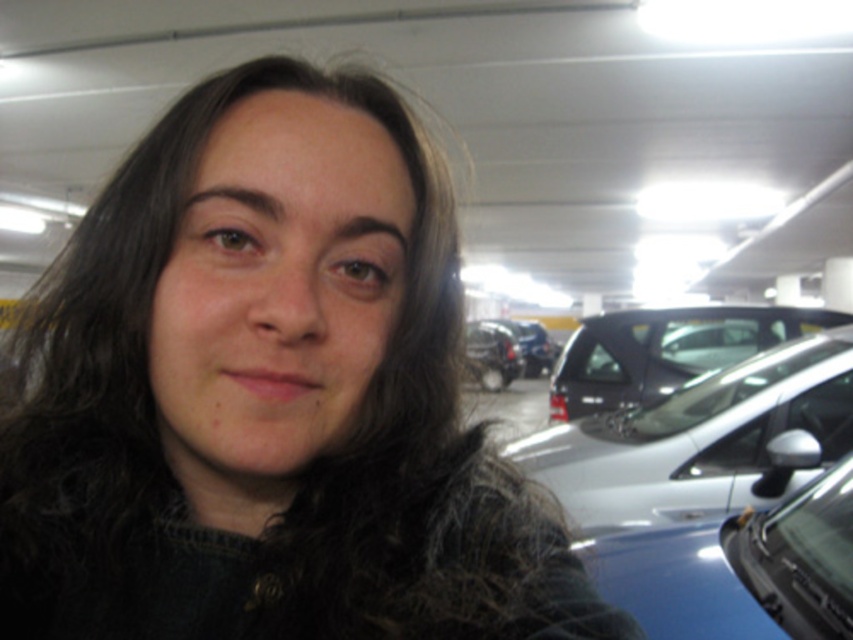
Is satin silver car at right smaller than shiny black car at center?

Incorrect, satin silver car at right is not smaller in size than shiny black car at center.

Is satin silver car at right to the left of shiny black car at center from the viewer's perspective?

Correct, you'll find satin silver car at right to the left of shiny black car at center.

Is point (733, 426) farther from camera compared to point (488, 360)?

No, (733, 426) is in front of (488, 360).

Locate an element on the screen. satin silver car at right is located at coordinates (703, 440).

Between dark brown hair at center and shiny black car at center, which one has more height?

With more height is shiny black car at center.

Can you confirm if dark brown hair at center is positioned to the right of shiny black car at center?

No, dark brown hair at center is not to the right of shiny black car at center.

Which is in front, point (149, 284) or point (473, 352)?

Point (149, 284)

Locate an element on the screen. This screenshot has width=853, height=640. dark brown hair at center is located at coordinates (268, 396).

Does shiny black suv at center come behind shiny black car at center?

That is False.

Is point (560, 387) closer to camera compared to point (509, 344)?

That is True.

Measure the distance between point (624, 392) and camera.

Point (624, 392) and camera are 12.93 feet apart from each other.

What are the coordinates of `shiny black suv at center` in the screenshot? It's located at (665, 349).